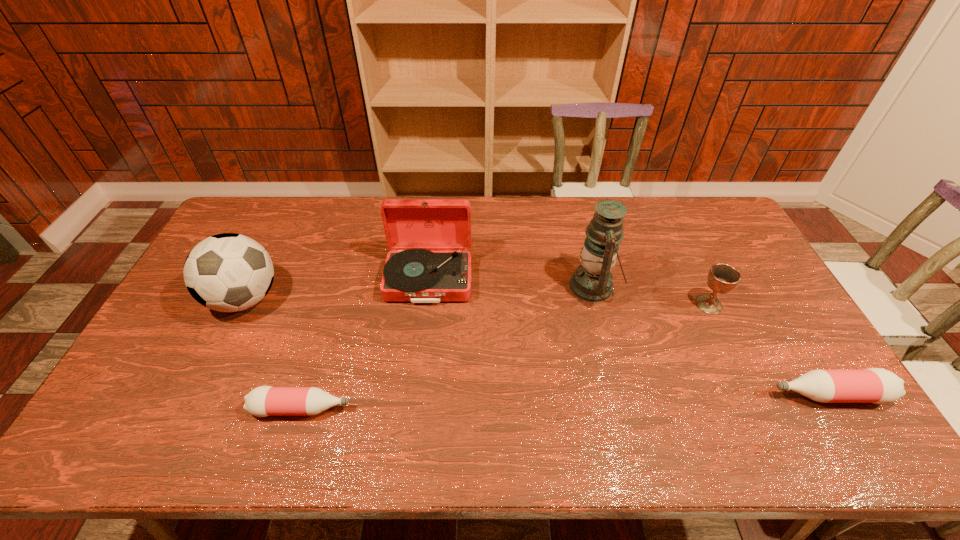
Identify the location of vacant space in between the left bottle and the oil lamp. (447, 347).

Identify the location of vacant area that lies between the second shortest object and the leftmost object. The height and width of the screenshot is (540, 960). (537, 347).

You are a GUI agent. You are given a task and a screenshot of the screen. Output one action in this format:
    pyautogui.click(x=<x>, y=<y>)
    Task: Click on the free space that is in between the second object from right to left and the left bottle
    This screenshot has width=960, height=540.
    Given the screenshot: What is the action you would take?
    pyautogui.click(x=505, y=356)

Image resolution: width=960 pixels, height=540 pixels. Identify the location of vacant area that lies between the oil lamp and the chalice. (651, 295).

At what (x,y) coordinates should I click in order to perform the action: click on vacant space in between the rightmost object and the second object from right to left. Please return your answer as a coordinate pair (x, y). Image resolution: width=960 pixels, height=540 pixels. Looking at the image, I should click on (768, 350).

I want to click on the third closest object relative to the left bottle, so click(x=592, y=281).

Find the location of a particular element. This screenshot has width=960, height=540. object identified as the fourth closest to the left bottle is located at coordinates (722, 278).

What are the coordinates of `vacant space that satisfies the following two spatial constraints: 1. on the front-facing side of the phonograph_record; 2. with the cap open on the shortest object` in the screenshot? It's located at (415, 409).

At what (x,y) coordinates should I click in order to perform the action: click on free point that satisfies the following two spatial constraints: 1. on the front-facing side of the second object from right to left; 2. on the right side of the phonograph_record. Please return your answer as a coordinate pair (x, y). This screenshot has height=540, width=960. Looking at the image, I should click on (426, 305).